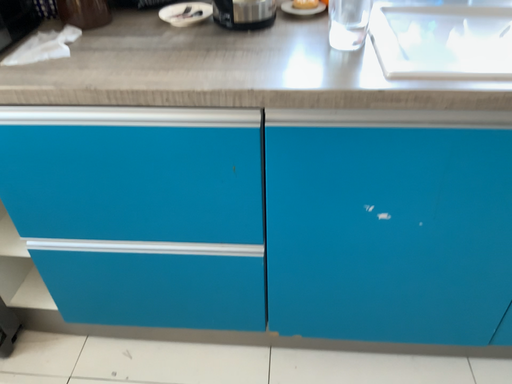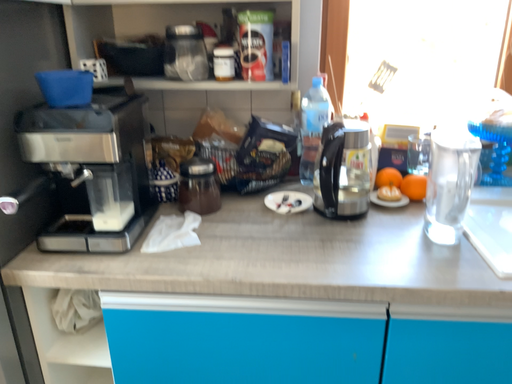
Question: How did the camera likely rotate when shooting the video?

Choices:
 (A) rotated upward
 (B) rotated downward

Answer: (A)